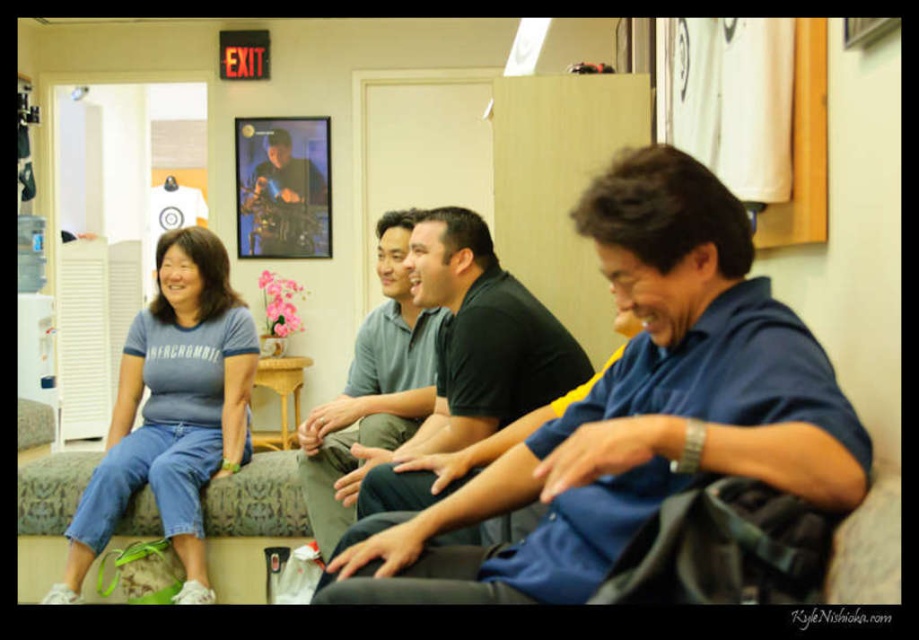
Question: Which point is farther from the camera taking this photo?

Choices:
 (A) (429, 602)
 (B) (396, 326)
 (C) (21, 560)
 (D) (461, 253)

Answer: (C)

Question: Is dark green polo shirt at center to the right of denim couch at center from the viewer's perspective?

Choices:
 (A) no
 (B) yes

Answer: (B)

Question: From the image, what is the correct spatial relationship of dark green polo shirt at center in relation to light blue cotton shirt at center?

Choices:
 (A) right
 (B) left

Answer: (A)

Question: Estimate the real-world distances between objects in this image. Which object is closer to the denim couch at center?

Choices:
 (A) blue cotton shirt at left
 (B) light blue cotton shirt at center
 (C) blue cotton shirt at center

Answer: (A)

Question: Does blue cotton shirt at center appear on the left side of blue cotton shirt at left?

Choices:
 (A) no
 (B) yes

Answer: (A)

Question: Estimate the real-world distances between objects in this image. Which object is farther from the denim couch at center?

Choices:
 (A) blue cotton shirt at left
 (B) light blue cotton shirt at center
 (C) blue cotton shirt at center

Answer: (C)